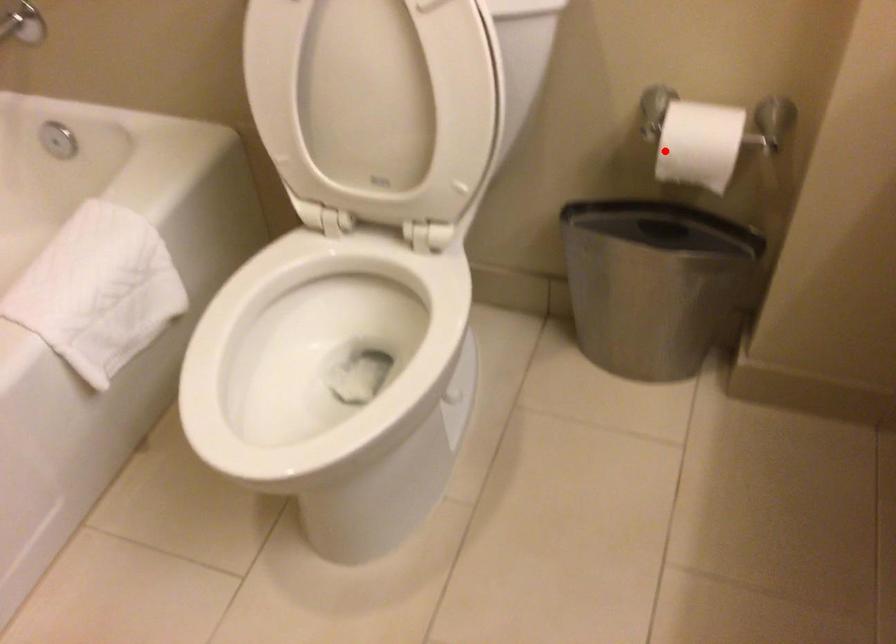
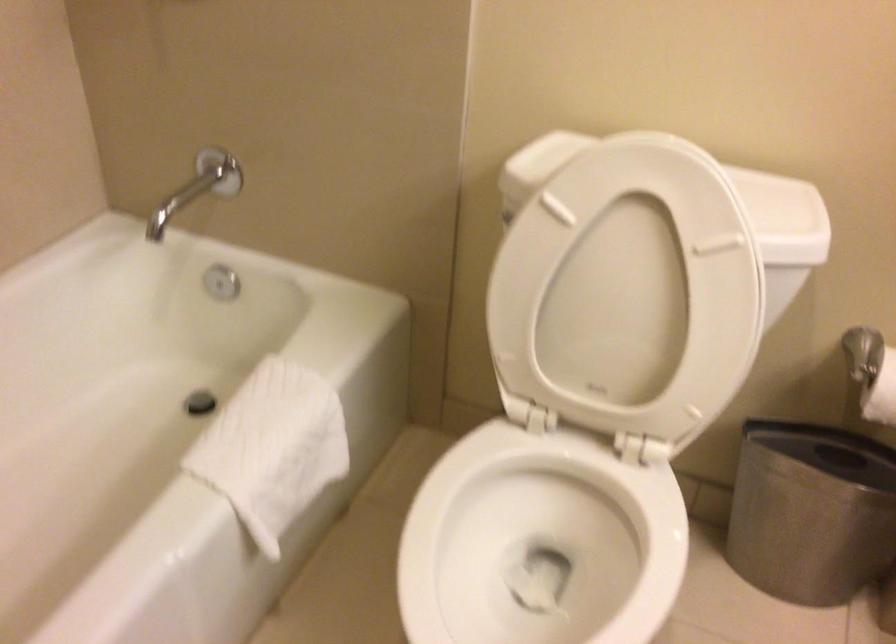
Locate, in the second image, the point that corresponds to the highlighted location in the first image.

(881, 393)